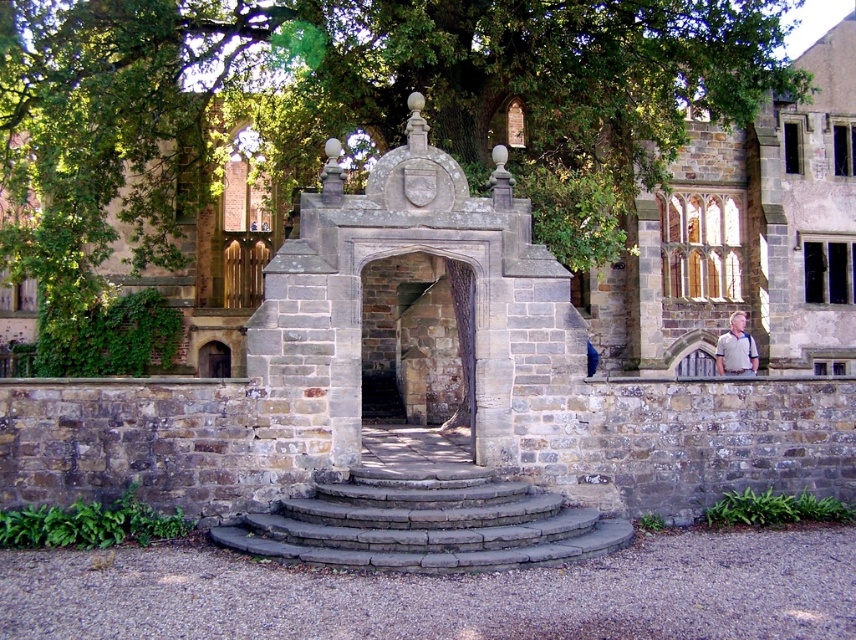
Question: Which point is closer to the camera?

Choices:
 (A) gray cotton shirt at right
 (B) stone archway at center

Answer: (B)

Question: Among these objects, which one is nearest to the camera?

Choices:
 (A) gray cotton shirt at right
 (B) stone archway at center

Answer: (B)

Question: Considering the real-world distances, which object is closest to the stone archway at center?

Choices:
 (A) gray cotton shirt at right
 (B) green leafy tree at upper center
 (C) gray stone stairs at center

Answer: (B)

Question: Is gray stone stairs at center below gray cotton shirt at right?

Choices:
 (A) no
 (B) yes

Answer: (B)

Question: Can you confirm if green leafy tree at upper center is positioned to the right of gray stone stairs at center?

Choices:
 (A) no
 (B) yes

Answer: (A)

Question: Does green leafy tree at upper center have a larger size compared to gray stone stairs at center?

Choices:
 (A) no
 (B) yes

Answer: (B)